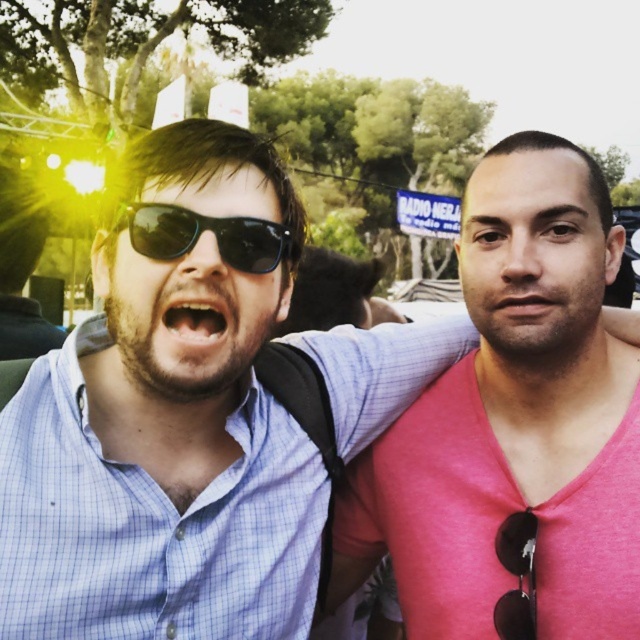
Can you confirm if white glossy teeth at center is taller than blue checkered shirt at left?

No, white glossy teeth at center is not taller than blue checkered shirt at left.

Is white glossy teeth at center positioned at the back of blue checkered shirt at left?

No, it is not.

The image size is (640, 640). What do you see at coordinates (195, 314) in the screenshot?
I see `white glossy teeth at center` at bounding box center [195, 314].

The height and width of the screenshot is (640, 640). I want to click on white glossy teeth at center, so click(x=195, y=314).

Can you confirm if black plastic sunglasses at center is bigger than pink matte skin at center?

Actually, black plastic sunglasses at center might be smaller than pink matte skin at center.

From the picture: Who is lower down, black plastic sunglasses at center or pink matte skin at center?

black plastic sunglasses at center

Is point (228, 262) closer to camera compared to point (522, 189)?

Yes, point (228, 262) is closer to viewer.

Identify the location of black plastic sunglasses at center. (204, 230).

Who is positioned more to the left, matte black sunglasses at center or blue checkered shirt at left?

Positioned to the left is blue checkered shirt at left.

Does matte black sunglasses at center have a smaller size compared to blue checkered shirt at left?

Correct, matte black sunglasses at center occupies less space than blue checkered shirt at left.

Is point (282, 298) positioned before point (77, 349)?

That is False.

Locate an element on the screen. The height and width of the screenshot is (640, 640). matte black sunglasses at center is located at coordinates (184, 314).